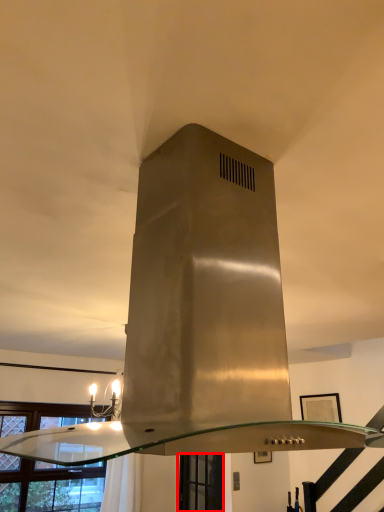
Question: Considering the relative positions of window (annotated by the red box) and window in the image provided, where is window (annotated by the red box) located with respect to the staircase?

Choices:
 (A) right
 (B) left

Answer: (A)